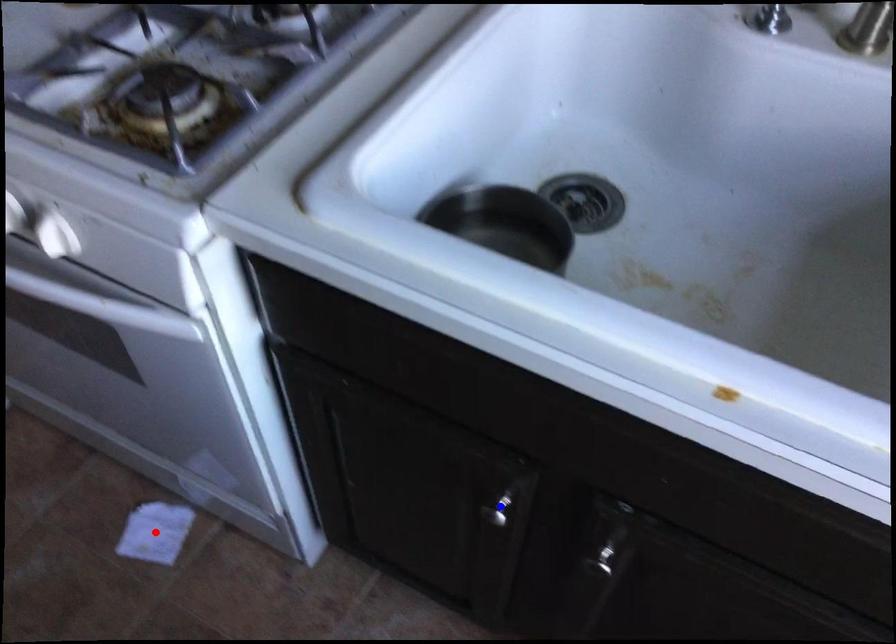
Question: In the image, two points are highlighted. Which point is nearer to the camera? Reply with the corresponding letter.

Choices:
 (A) blue point
 (B) red point

Answer: (A)